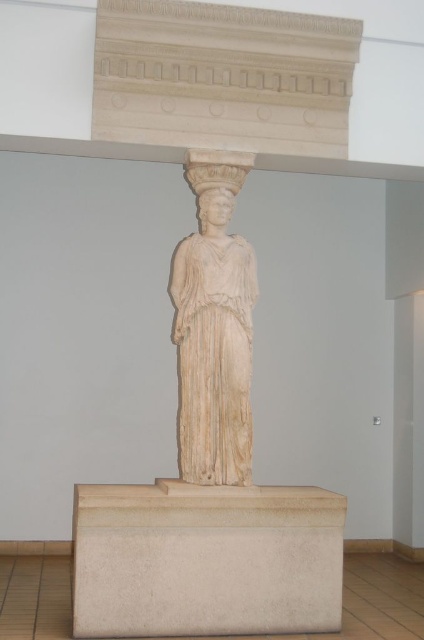
Does white marble pedestal at center have a lesser height compared to white marble statue at center?

Indeed, white marble pedestal at center has a lesser height compared to white marble statue at center.

Measure the distance between white marble pedestal at center and white marble statue at center.

white marble pedestal at center and white marble statue at center are 27.32 inches apart from each other.

Find the location of `white marble pedestal at center`. white marble pedestal at center is located at coordinates (206, 560).